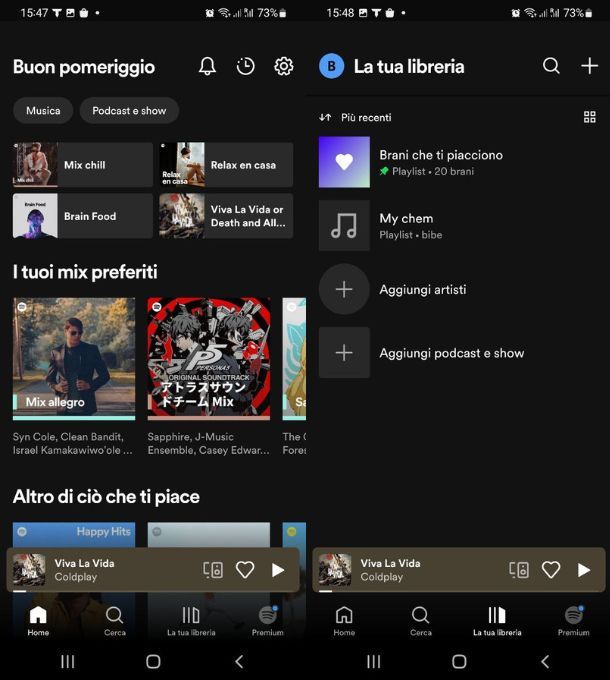
The height and width of the screenshot is (680, 610). I want to click on album, so click(115, 386).